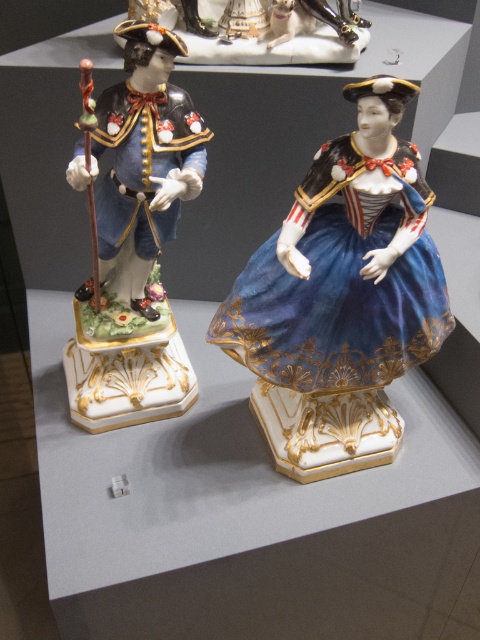
Does velvet blue dress at center have a smaller size compared to porcelain statue at upper center?

Actually, velvet blue dress at center might be larger than porcelain statue at upper center.

In the scene shown: Between velvet blue dress at center and porcelain statue at upper center, which one is positioned higher?

porcelain statue at upper center is above.

Which is in front, point (398, 257) or point (229, 35)?

Point (398, 257)

Locate an element on the screen. The image size is (480, 640). velvet blue dress at center is located at coordinates (343, 280).

Between point (75, 308) and point (249, 26), which one is positioned in front?

Positioned in front is point (75, 308).

Does porcelain figurine at left have a lesser width compared to porcelain statue at upper center?

Incorrect, porcelain figurine at left's width is not less than porcelain statue at upper center's.

Image resolution: width=480 pixels, height=640 pixels. In order to click on porcelain figurine at left in this screenshot , I will do `click(136, 236)`.

Can you confirm if velvet blue dress at center is positioned below porcelain figurine at left?

Correct, velvet blue dress at center is located below porcelain figurine at left.

Which is above, velvet blue dress at center or porcelain figurine at left?

porcelain figurine at left

What do you see at coordinates (343, 280) in the screenshot? I see `velvet blue dress at center` at bounding box center [343, 280].

Find the location of a particular element. Image resolution: width=480 pixels, height=640 pixels. velvet blue dress at center is located at coordinates (343, 280).